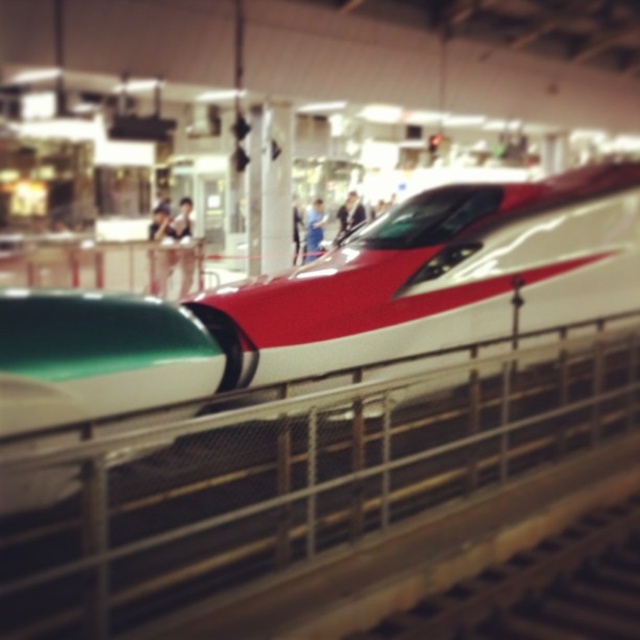
Which is above, white glossy rail at center or smooth fabric shirt at center?

smooth fabric shirt at center is higher up.

The width and height of the screenshot is (640, 640). Describe the element at coordinates (291, 472) in the screenshot. I see `white glossy rail at center` at that location.

Image resolution: width=640 pixels, height=640 pixels. I want to click on white glossy rail at center, so click(291, 472).

Measure the distance between white glossy rail at center and camera.

9.12 feet

Which is behind, point (230, 564) or point (308, 236)?

Positioned behind is point (308, 236).

This screenshot has height=640, width=640. In order to click on white glossy rail at center in this screenshot , I will do `click(291, 472)`.

Between shiny metallic train at center and smooth fabric shirt at center, which one appears on the left side from the viewer's perspective?

shiny metallic train at center is more to the left.

Does point (371, 282) come farther from viewer compared to point (340, 209)?

No, (371, 282) is in front of (340, 209).

You are a GUI agent. You are given a task and a screenshot of the screen. Output one action in this format:
    pyautogui.click(x=<x>, y=<y>)
    Task: Click on the shiny metallic train at center
    The width and height of the screenshot is (640, 640).
    Given the screenshot: What is the action you would take?
    pyautogui.click(x=326, y=305)